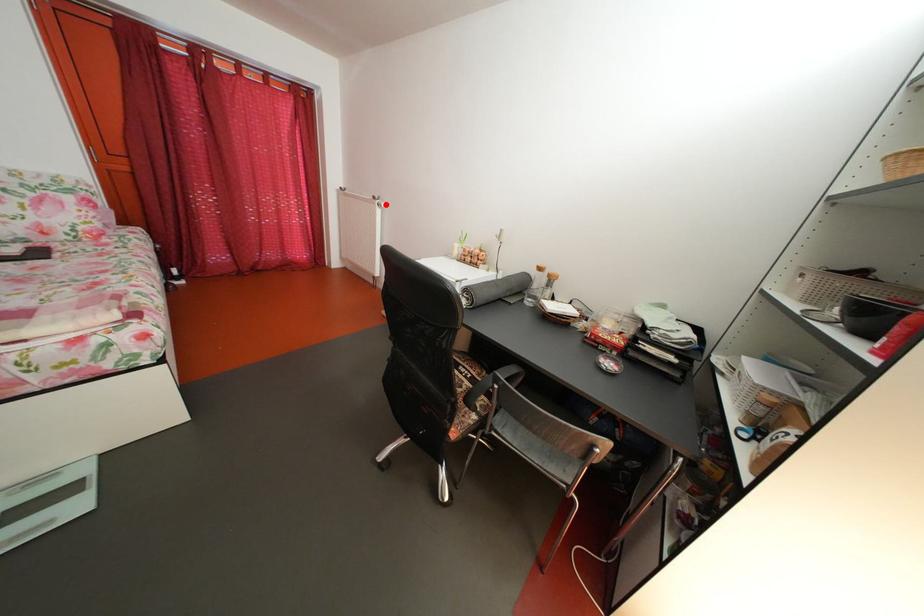
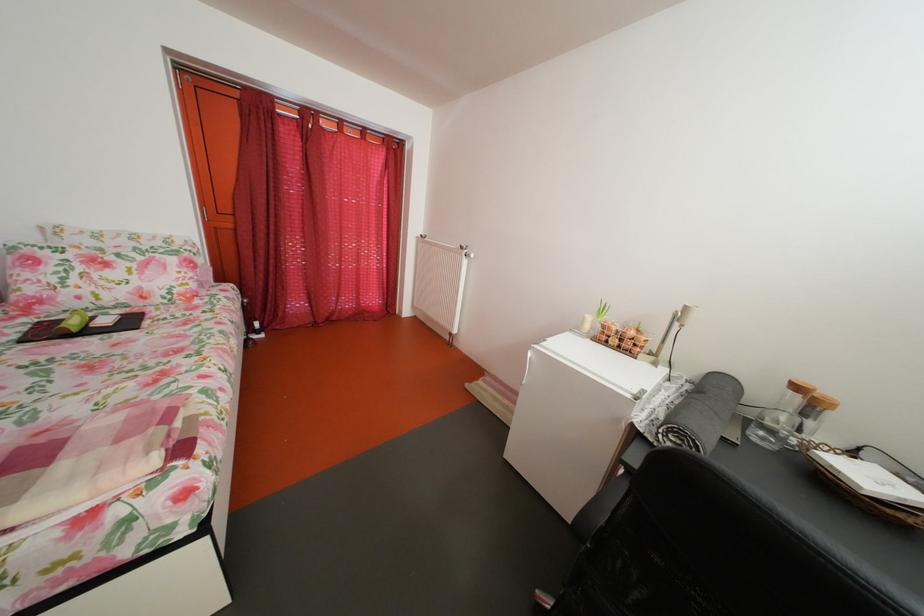
Find the pixel in the second image that matches the highlighted location in the first image.

(473, 254)